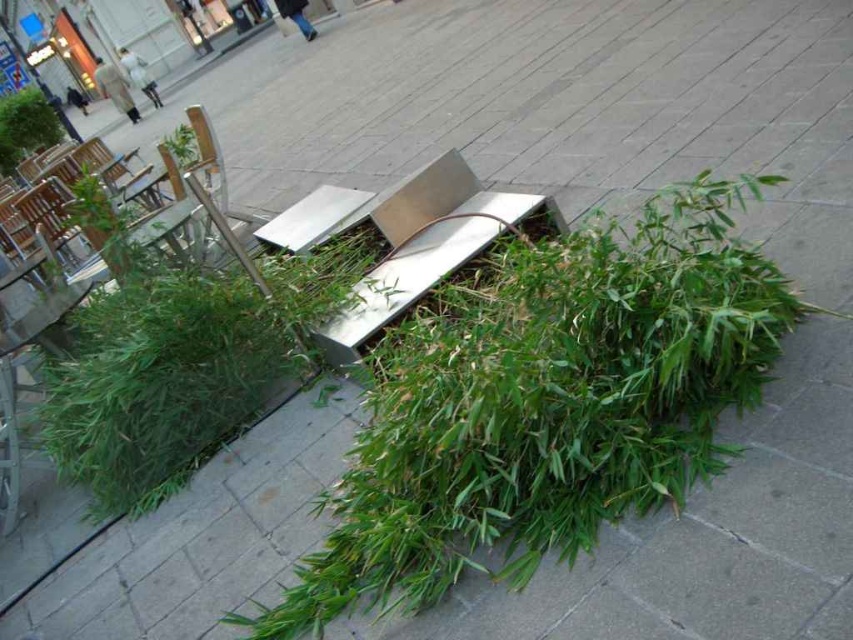
Question: Which point appears closest to the camera in this image?

Choices:
 (A) (498, 228)
 (B) (44, 147)

Answer: (A)

Question: Which of the following is the closest to the observer?

Choices:
 (A) (16, 102)
 (B) (361, 317)

Answer: (B)

Question: Can you confirm if stainless steel bench at center is thinner than green leafy plant at upper left?

Choices:
 (A) yes
 (B) no

Answer: (B)

Question: Is stainless steel bench at center thinner than green leafy plant at upper left?

Choices:
 (A) yes
 (B) no

Answer: (B)

Question: Is stainless steel bench at center to the left of green leafy plant at upper left from the viewer's perspective?

Choices:
 (A) no
 (B) yes

Answer: (A)